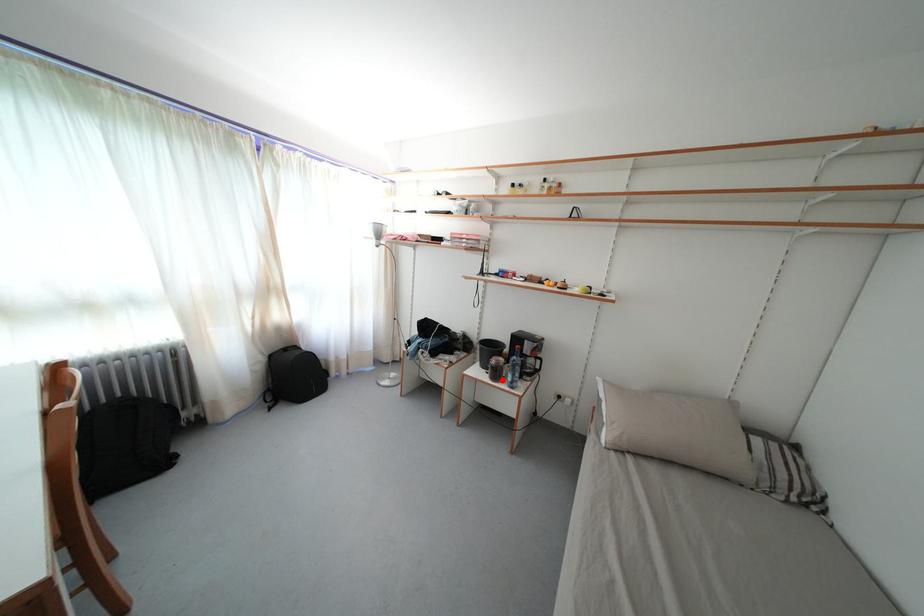
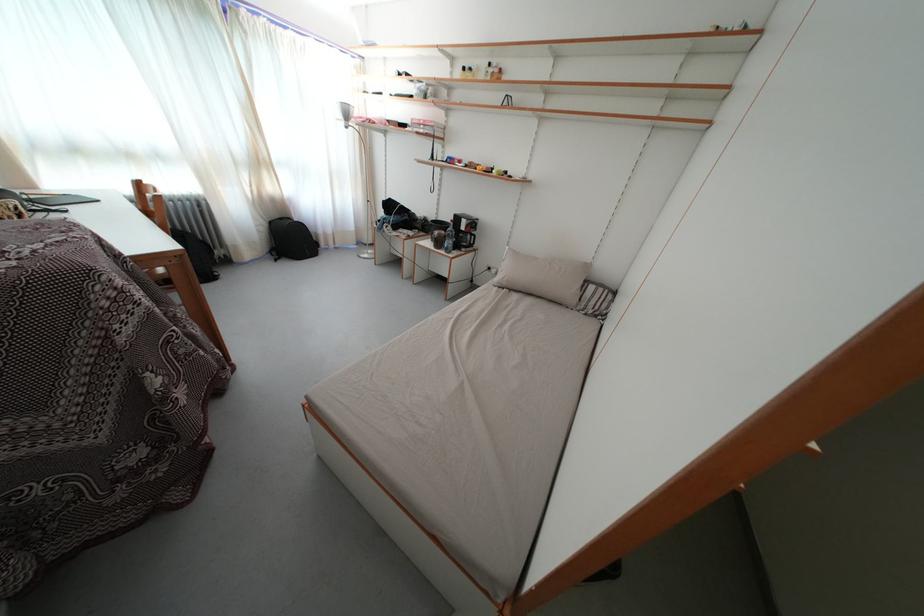
The point at the highlighted location is marked in the first image. Where is the corresponding point in the second image?

(444, 249)